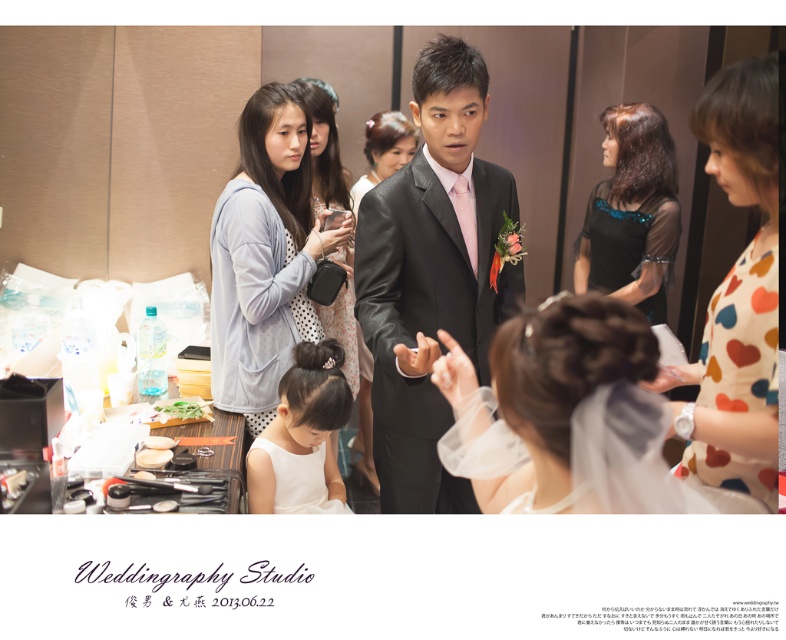
You are a photographer positioned at the front of the scene. You need to capture a clear shot of both the light blue fabric at center and the light gray polka dot dress at center. Which object will appear larger in your photo?

The light blue fabric at center will appear larger in the photo because it is closer to the viewer than the light gray polka dot dress at center.